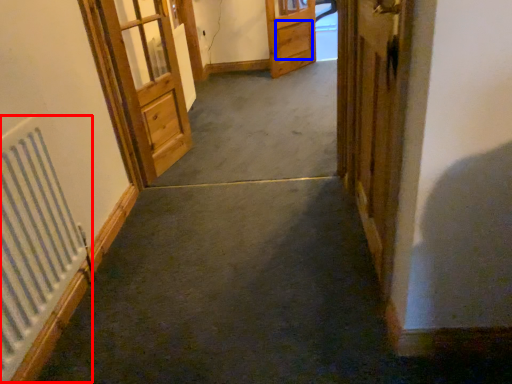
Question: Among these objects, which one is nearest to the camera, radiator (highlighted by a red box) or drawer (highlighted by a blue box)?

Choices:
 (A) radiator
 (B) drawer

Answer: (A)